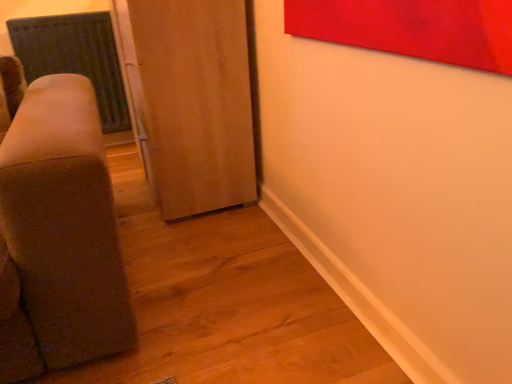
Identify the location of wooden door at center. (191, 101).

What do you see at coordinates (191, 101) in the screenshot? I see `wooden door at center` at bounding box center [191, 101].

Based on the photo, measure the distance between point (201, 179) and camera.

Point (201, 179) and camera are 5.87 feet apart.

In order to face wooden door at center, should I rotate leftwards or rightwards?

A 10.691 degree turn to the left will do.

In order to face satin green radiator at left, should I rotate leftwards or rightwards?

To align with it, rotate left about 23.254°.

What do you see at coordinates (75, 57) in the screenshot? I see `satin green radiator at left` at bounding box center [75, 57].

Where is `satin green radiator at left`? The image size is (512, 384). satin green radiator at left is located at coordinates (75, 57).

The image size is (512, 384). What are the coordinates of `wooden door at center` in the screenshot? It's located at (191, 101).

Is wooden door at center to the right of satin green radiator at left from the viewer's perspective?

Yes, wooden door at center is to the right of satin green radiator at left.

Does wooden door at center lie behind satin green radiator at left?

No, wooden door at center is closer to the viewer.

Is point (216, 146) closer or farther from the camera than point (106, 129)?

Point (216, 146) appears to be closer to the viewer than point (106, 129).

From the image's perspective, which object appears higher, wooden door at center or satin green radiator at left?

satin green radiator at left, from the image's perspective.

In the scene shown: From a real-world perspective, which is physically below, wooden door at center or satin green radiator at left?

From a 3D spatial view, wooden door at center is below.

Based on the photo, does wooden door at center have a greater width compared to satin green radiator at left?

Yes.

From their relative heights in the image, would you say wooden door at center is taller or shorter than satin green radiator at left?

Considering their sizes, wooden door at center has more height than satin green radiator at left.

Considering the sizes of objects wooden door at center and satin green radiator at left in the image provided, who is bigger, wooden door at center or satin green radiator at left?

wooden door at center is bigger.

Is wooden door at center inside the boundaries of satin green radiator at left, or outside?

wooden door at center is located beyond the bounds of satin green radiator at left.

Looking at this image, is wooden door at center in contact with satin green radiator at left?

They are not placed beside each other.

Consider the image. Is satin green radiator at left at the back of wooden door at center?

No, wooden door at center is not facing the opposite direction of satin green radiator at left.

The width and height of the screenshot is (512, 384). What are the coordinates of `door lying on the right of satin green radiator at left` in the screenshot? It's located at (191, 101).

Between satin green radiator at left and wooden door at center, which one appears on the left side from the viewer's perspective?

satin green radiator at left is more to the left.

Is satin green radiator at left closer to camera compared to wooden door at center?

No, satin green radiator at left is further to the viewer.

Between point (47, 36) and point (243, 86), which one is positioned behind?

The point (47, 36) is farther.

From the image's perspective, which is above, satin green radiator at left or wooden door at center?

satin green radiator at left appears higher in the image.

From the picture: From a real-world perspective, between satin green radiator at left and wooden door at center, who is vertically higher?

satin green radiator at left is physically above.

Considering the relative sizes of satin green radiator at left and wooden door at center in the image provided, is satin green radiator at left wider than wooden door at center?

No, satin green radiator at left is not wider than wooden door at center.

Based on the photo, considering the sizes of objects satin green radiator at left and wooden door at center in the image provided, who is taller, satin green radiator at left or wooden door at center?

wooden door at center is taller.

Is satin green radiator at left smaller than wooden door at center?

Correct, satin green radiator at left occupies less space than wooden door at center.

Is satin green radiator at left positioned beyond the bounds of wooden door at center?

That's correct, satin green radiator at left is outside of wooden door at center.

Based on the photo, is satin green radiator at left in contact with wooden door at center?

No.

Is wooden door at center at the back of satin green radiator at left?

No, satin green radiator at left is not facing away from wooden door at center.

Can you tell me how much satin green radiator at left and wooden door at center differ in facing direction?

There is a 90.3-degree angle between the facing directions of satin green radiator at left and wooden door at center.

This screenshot has width=512, height=384. In order to click on door below the satin green radiator at left (from the image's perspective) in this screenshot , I will do `click(191, 101)`.

Locate an element on the screen. This screenshot has height=384, width=512. door on the right of satin green radiator at left is located at coordinates (191, 101).

At what (x,y) coordinates should I click in order to perform the action: click on door below the satin green radiator at left (from a real-world perspective). Please return your answer as a coordinate pair (x, y). Image resolution: width=512 pixels, height=384 pixels. Looking at the image, I should click on (191, 101).